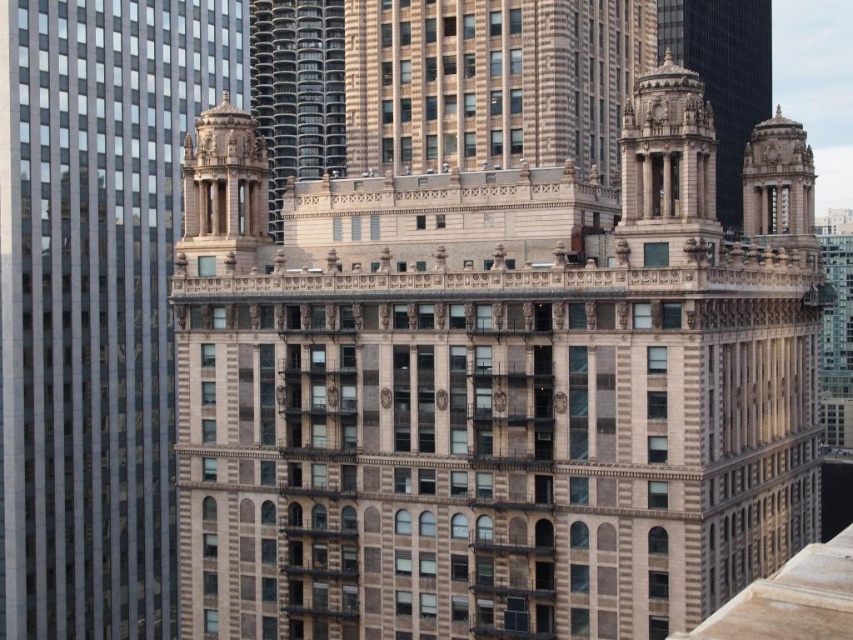
Does brown stone building at center appear on the left side of beige stone tower at center?

In fact, brown stone building at center is to the right of beige stone tower at center.

In the scene shown: Does brown stone building at center have a larger size compared to beige stone tower at center?

Correct, brown stone building at center is larger in size than beige stone tower at center.

Image resolution: width=853 pixels, height=640 pixels. What do you see at coordinates (495, 388) in the screenshot?
I see `brown stone building at center` at bounding box center [495, 388].

You are a GUI agent. You are given a task and a screenshot of the screen. Output one action in this format:
    pyautogui.click(x=<x>, y=<y>)
    Task: Click on the brown stone building at center
    
    Given the screenshot: What is the action you would take?
    pyautogui.click(x=495, y=388)